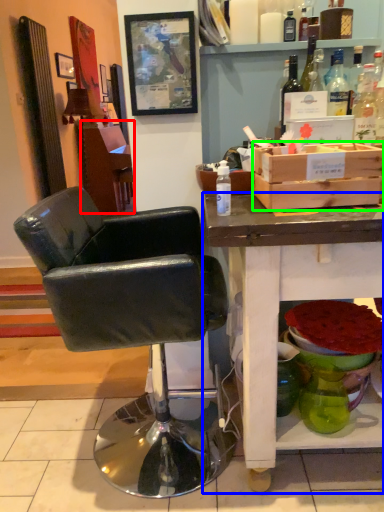
Question: Which object is the closest to the vanity (highlighted by a red box)? Choose among these: desk (highlighted by a blue box) or box (highlighted by a green box).

Choices:
 (A) desk
 (B) box

Answer: (B)